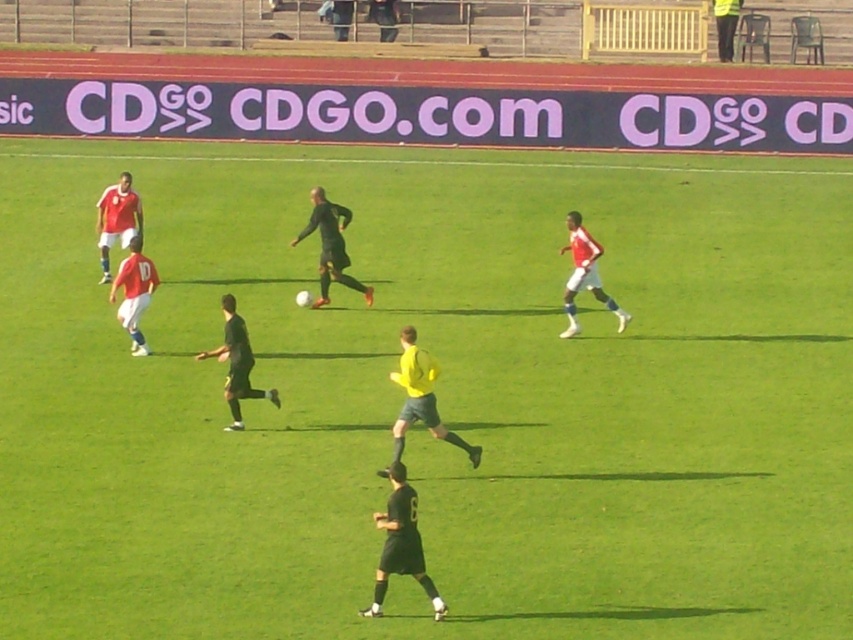
You are a soccer coach analyzing the match. You need to locate the black matte soccer player at center. Where exactly is he positioned on the field?

The black matte soccer player at center is positioned at point coordinates of (x=329, y=244) on the field.

You are a spectator at the soccer match and want to take a photo of the black matte soccer player at center and the matte red jersey at upper left. Based on their positions, which player should you focus on first to ensure both are in the frame?

The black matte soccer player at center is below the matte red jersey at upper left, so you should focus on the matte red jersey at upper left first to ensure both are in the frame.

You are a photographer positioned at the edge of the soccer field. You need to capture a photo where both the black matte uniform at center and the matte red jersey at left are visible. Based on their heights, which player should you position closer to the camera to ensure both are fully visible in the frame?

The black matte uniform at center has a lesser height compared to the matte red jersey at left. To ensure both are fully visible, position the black matte uniform at center closer to the camera since it is shorter and needs to be magnified slightly to match the visibility of the taller matte red jersey at left.